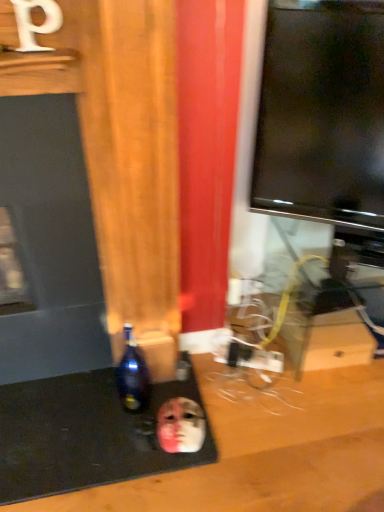
Question: In the image, is dark blue glass bottle at lower left positioned in front of or behind smooth matte face at lower center?

Choices:
 (A) front
 (B) behind

Answer: (A)

Question: Is dark blue glass bottle at lower left bigger or smaller than smooth matte face at lower center?

Choices:
 (A) big
 (B) small

Answer: (A)

Question: Do you think dark blue glass bottle at lower left is within smooth matte face at lower center, or outside of it?

Choices:
 (A) inside
 (B) outside

Answer: (B)

Question: Looking at their shapes, would you say smooth matte face at lower center is wider or thinner than dark blue glass bottle at lower left?

Choices:
 (A) thin
 (B) wide

Answer: (B)

Question: In terms of size, does smooth matte face at lower center appear bigger or smaller than dark blue glass bottle at lower left?

Choices:
 (A) small
 (B) big

Answer: (A)

Question: In terms of height, does smooth matte face at lower center look taller or shorter compared to dark blue glass bottle at lower left?

Choices:
 (A) tall
 (B) short

Answer: (B)

Question: Considering their positions, is smooth matte face at lower center located in front of or behind dark blue glass bottle at lower left?

Choices:
 (A) behind
 (B) front

Answer: (A)